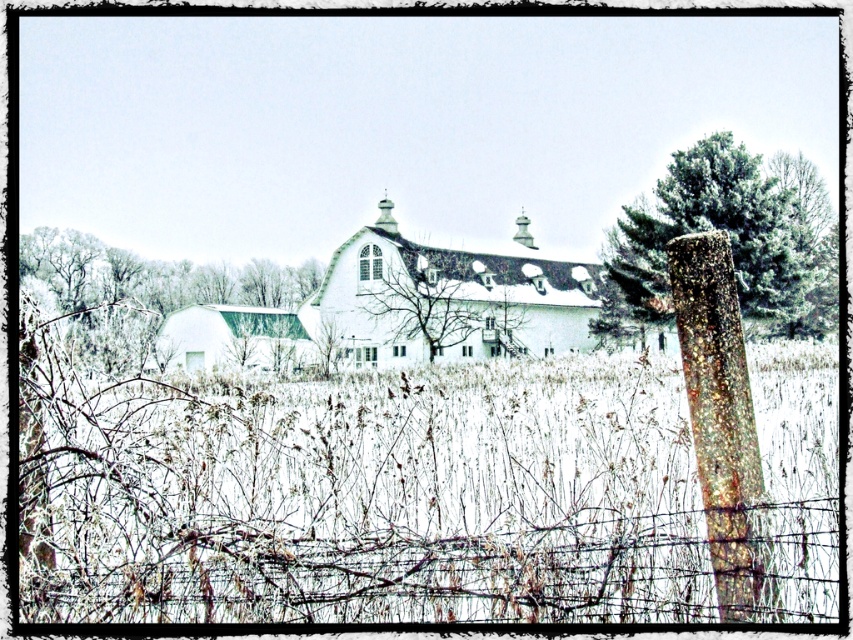
Question: Is green matte barn at left to the left of bare branches at center from the viewer's perspective?

Choices:
 (A) yes
 (B) no

Answer: (A)

Question: Which object appears farthest from the camera in this image?

Choices:
 (A) white matte barn at center
 (B) green textured pine at right
 (C) green matte barn at left

Answer: (B)

Question: Which object is farther from the camera taking this photo?

Choices:
 (A) green textured pine at right
 (B) white matte barn at center
 (C) bare branches at center

Answer: (C)

Question: Is the position of barbed wire fence at lower center less distant than that of green matte barn at left?

Choices:
 (A) no
 (B) yes

Answer: (B)

Question: Which of the following is the closest to the observer?

Choices:
 (A) white matte barn at center
 (B) green textured pine at right
 (C) green matte barn at left

Answer: (C)

Question: Is barbed wire fence at lower center closer to camera compared to green matte barn at left?

Choices:
 (A) yes
 (B) no

Answer: (A)